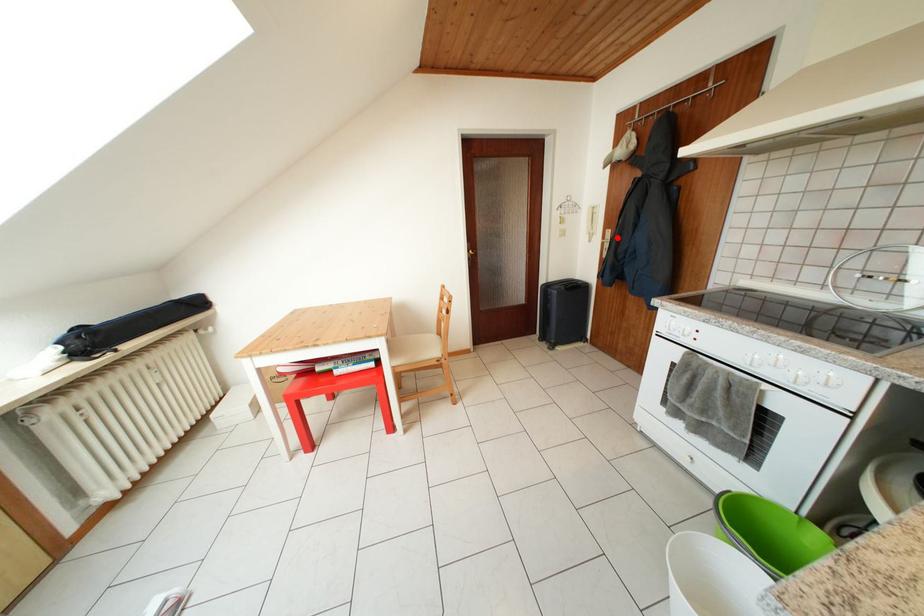
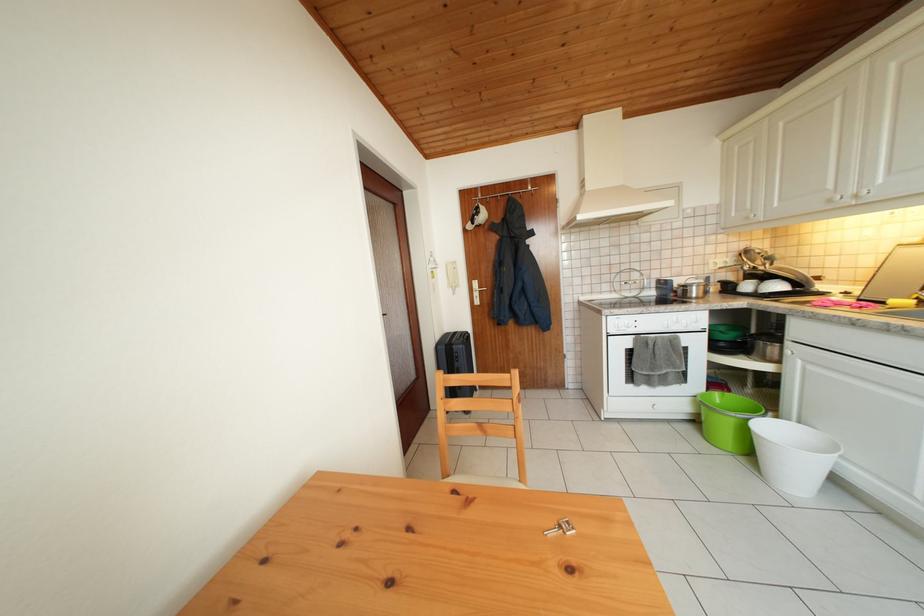
In the second image, find the point that corresponds to the highlighted location in the first image.

(483, 288)